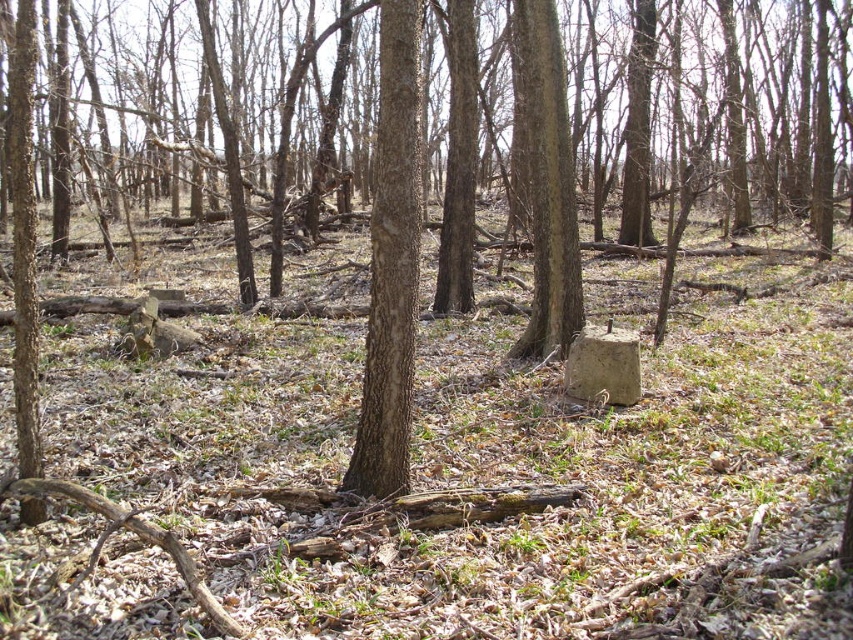
Question: Considering the real-world distances, which object is farthest from the rough bark tree at center?

Choices:
 (A) brown rough bark tree trunk at center
 (B) brown rough bark tree at lower left

Answer: (B)

Question: Does brown rough bark tree trunk at center have a lesser width compared to rough bark tree at center?

Choices:
 (A) no
 (B) yes

Answer: (B)

Question: Which object is closer to the camera taking this photo?

Choices:
 (A) rough bark tree at center
 (B) brown rough bark tree at lower left

Answer: (B)

Question: Among these objects, which one is farthest from the camera?

Choices:
 (A) rough bark tree at center
 (B) brown rough bark tree at lower left

Answer: (A)

Question: Can you confirm if brown rough bark tree trunk at center is smaller than rough bark tree at center?

Choices:
 (A) yes
 (B) no

Answer: (A)

Question: Can you confirm if brown rough bark tree trunk at center is positioned to the right of rough bark tree at center?

Choices:
 (A) no
 (B) yes

Answer: (A)